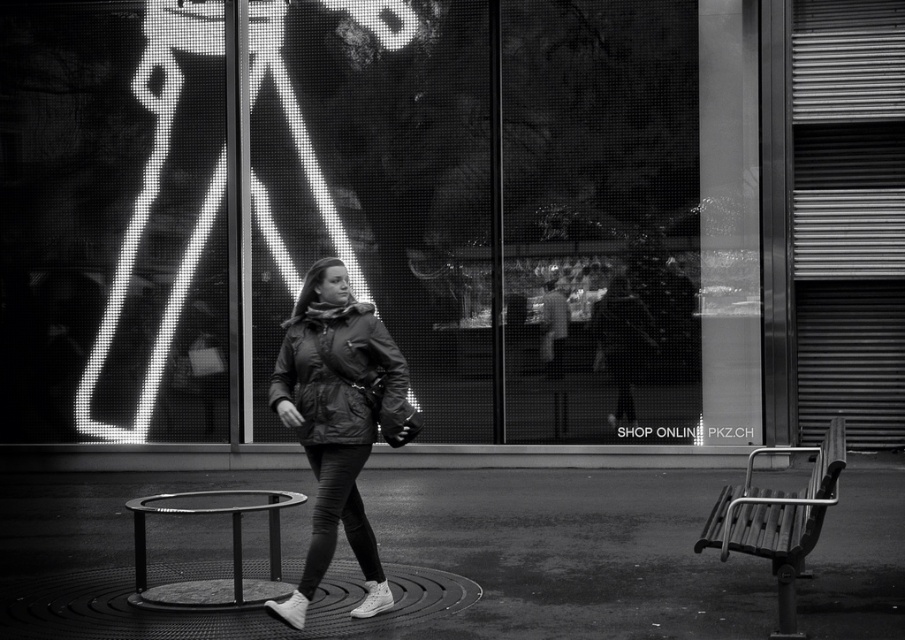
You are a delivery person trying to hand a package to the woman in the matte black jacket at center. The shop has a policy that deliveries can only be accepted through the matte glass shop window at center. Can you hand the package to her through the window?

The matte glass shop window at center is to the left of the matte black jacket at center, so the woman is positioned to the right of the window. Since the window is part of the storefront, the delivery person can hand the package through the window to the woman who is outside the store near the window.

You are a delivery person standing in front of the matte glass shop window at center and the metallic stool at center. You need to place a package on the nearest object. Which object should you choose?

The matte glass shop window at center is closer to you than the metallic stool at center, so you should place the package on the matte glass shop window at center.

You are a delivery person trying to place a large package on the ground in the scene. The package is too heavy to lift, so you need to roll it. The path is clear except for two objects in the center of the image. Which object between the circular metal grate at center and the metallic stool at center should you avoid rolling the package over to prevent damage?

You should avoid rolling the package over the metallic stool at center because the circular metal grate at center occupies less space and is likely smaller, making it less stable to roll over compared to the larger metallic stool at center. However, since the grate might be fragile, it is safer to avoid both. Wait, the description says the grate occupies less space than the stool. The question is about avoiding damage. Since the stool is larger, it might be more stable, but the grate could be fragile. Hmm,